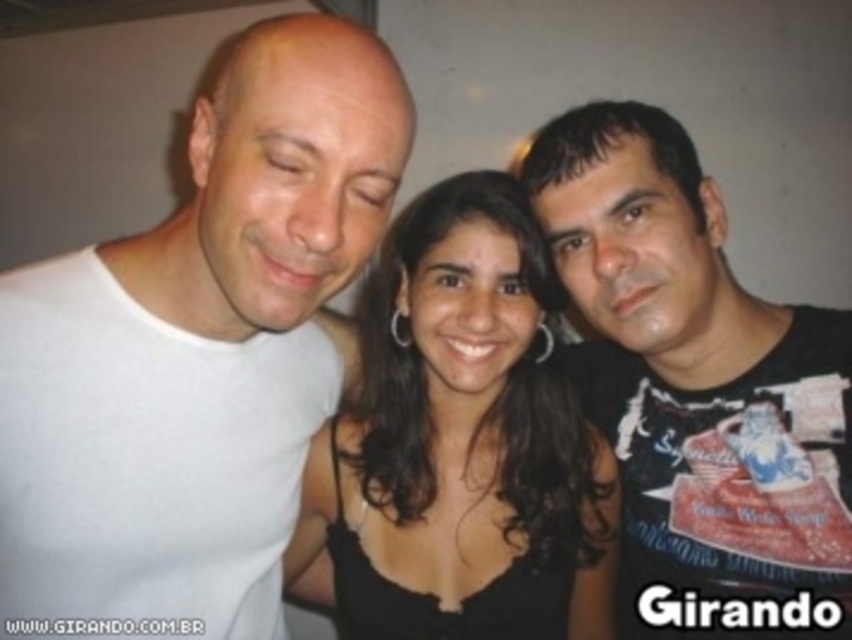
Question: Is white matte t-shirt at left closer to camera compared to black printed t-shirt at center?

Choices:
 (A) yes
 (B) no

Answer: (A)

Question: Does white matte t-shirt at left have a smaller size compared to black printed t-shirt at center?

Choices:
 (A) yes
 (B) no

Answer: (B)

Question: Which object is closer to the camera taking this photo?

Choices:
 (A) white matte t-shirt at left
 (B) black matte dress at center

Answer: (A)

Question: In this image, where is black printed t-shirt at center located relative to black matte dress at center?

Choices:
 (A) right
 (B) left

Answer: (A)

Question: Which point is farther to the camera?

Choices:
 (A) click(537, 524)
 (B) click(117, 614)
 (C) click(655, 218)

Answer: (A)

Question: Which object appears closest to the camera in this image?

Choices:
 (A) white matte t-shirt at left
 (B) black matte dress at center

Answer: (A)